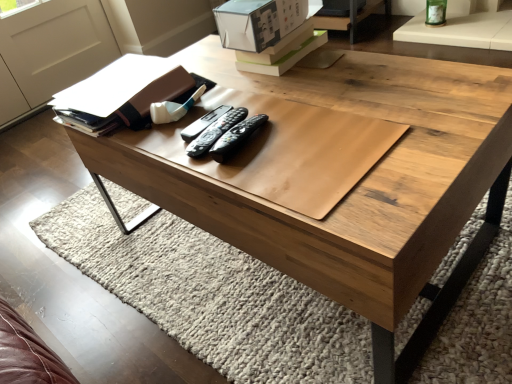
Describe the element at coordinates (258, 22) in the screenshot. The height and width of the screenshot is (384, 512). I see `white cardboard box at upper center` at that location.

Describe the element at coordinates (236, 137) in the screenshot. I see `black plastic remote at center, the 3th remote when ordered from left to right` at that location.

What do you see at coordinates (122, 92) in the screenshot? I see `matte brown book at upper left` at bounding box center [122, 92].

Where is `black plastic remote at center, marked as the 2th remote in a right-to-left arrangement`? The width and height of the screenshot is (512, 384). black plastic remote at center, marked as the 2th remote in a right-to-left arrangement is located at coordinates (211, 129).

Find the location of `white cardboard box at upper center`. white cardboard box at upper center is located at coordinates (258, 22).

Where is `cardboard box above the black plastic remote at center, acting as the 1th remote starting from the right (from the image's perspective)`? This screenshot has height=384, width=512. cardboard box above the black plastic remote at center, acting as the 1th remote starting from the right (from the image's perspective) is located at coordinates (258, 22).

Who is bigger, black plastic remote at center, acting as the 1th remote starting from the right, or white cardboard box at upper center?

Bigger between the two is white cardboard box at upper center.

Is black plastic remote at center, the 3th remote when ordered from left to right, positioned with its back to white cardboard box at upper center?

No, black plastic remote at center, the 3th remote when ordered from left to right,'s orientation is not away from white cardboard box at upper center.

Which is more to the right, black plastic remote at center, the 3th remote when ordered from left to right, or matte brown book at upper left?

black plastic remote at center, the 3th remote when ordered from left to right, is more to the right.

Could you tell me if black plastic remote at center, the 3th remote when ordered from left to right, is facing matte brown book at upper left?

No.

Is black plastic remote at center, acting as the 1th remote starting from the right, positioned before matte brown book at upper left?

That is True.

From a real-world perspective, which object stands above the other?

white cardboard box at upper center is physically above.

From the image's perspective, is white cardboard box at upper center above or below black plastic remote at center, which ranks as the 2th remote in left-to-right order?

Clearly, from the image's perspective, white cardboard box at upper center is above black plastic remote at center, which ranks as the 2th remote in left-to-right order.

In the scene shown: Would you consider white cardboard box at upper center to be distant from black plastic remote at center, which ranks as the 2th remote in left-to-right order?

No, white cardboard box at upper center is not far away from black plastic remote at center, which ranks as the 2th remote in left-to-right order.

Which is in front, point (288, 10) or point (206, 144)?

Positioned in front is point (206, 144).

Considering the relative sizes of black plastic remote at center, which ranks as the third remote in right-to-left order, and black plastic remote at center, acting as the 1th remote starting from the right, in the image provided, is black plastic remote at center, which ranks as the third remote in right-to-left order, wider than black plastic remote at center, acting as the 1th remote starting from the right,?

In fact, black plastic remote at center, which ranks as the third remote in right-to-left order, might be narrower than black plastic remote at center, acting as the 1th remote starting from the right.

Looking at this image, from the image's perspective, between black plastic remote at center, marked as the 1th remote in a left-to-right arrangement, and black plastic remote at center, acting as the 1th remote starting from the right, who is located below?

From the image's view, black plastic remote at center, acting as the 1th remote starting from the right, is below.

Which of these two, black plastic remote at center, which ranks as the third remote in right-to-left order, or black plastic remote at center, acting as the 1th remote starting from the right, stands taller?

With more height is black plastic remote at center, acting as the 1th remote starting from the right.

From a real-world perspective, who is located lower, white cardboard box at upper center or black plastic remote at center, marked as the 1th remote in a left-to-right arrangement?

In real-world perspective, black plastic remote at center, marked as the 1th remote in a left-to-right arrangement, is lower.

Is the depth of white cardboard box at upper center greater than that of black plastic remote at center, which ranks as the third remote in right-to-left order?

Yes, it is behind black plastic remote at center, which ranks as the third remote in right-to-left order.

Is white cardboard box at upper center shorter than black plastic remote at center, marked as the 1th remote in a left-to-right arrangement?

In fact, white cardboard box at upper center may be taller than black plastic remote at center, marked as the 1th remote in a left-to-right arrangement.

Can you confirm if white cardboard box at upper center is positioned to the left of black plastic remote at center, marked as the 1th remote in a left-to-right arrangement?

In fact, white cardboard box at upper center is to the right of black plastic remote at center, marked as the 1th remote in a left-to-right arrangement.

Is black plastic remote at center, marked as the 1th remote in a left-to-right arrangement, further to camera compared to black plastic remote at center, which ranks as the 2th remote in left-to-right order?

Yes, black plastic remote at center, marked as the 1th remote in a left-to-right arrangement, is further from the camera.

Which of these two, black plastic remote at center, marked as the 1th remote in a left-to-right arrangement, or black plastic remote at center, marked as the 2th remote in a right-to-left arrangement, is wider?

black plastic remote at center, marked as the 2th remote in a right-to-left arrangement.

Is black plastic remote at center, marked as the 1th remote in a left-to-right arrangement, inside or outside of black plastic remote at center, which ranks as the 2th remote in left-to-right order?

black plastic remote at center, marked as the 1th remote in a left-to-right arrangement, is outside black plastic remote at center, which ranks as the 2th remote in left-to-right order.

Which point is more forward, (211, 120) or (206, 152)?

The point (206, 152) is more forward.

Who is bigger, black plastic remote at center, marked as the 2th remote in a right-to-left arrangement, or black plastic remote at center, the 3th remote when ordered from left to right?

With larger size is black plastic remote at center, the 3th remote when ordered from left to right.

Which is correct: black plastic remote at center, marked as the 2th remote in a right-to-left arrangement, is inside black plastic remote at center, the 3th remote when ordered from left to right, or outside of it?

black plastic remote at center, marked as the 2th remote in a right-to-left arrangement, exists outside the volume of black plastic remote at center, the 3th remote when ordered from left to right.

Are black plastic remote at center, marked as the 2th remote in a right-to-left arrangement, and black plastic remote at center, the 3th remote when ordered from left to right, beside each other?

Yes, black plastic remote at center, marked as the 2th remote in a right-to-left arrangement, is beside black plastic remote at center, the 3th remote when ordered from left to right.

Locate an element on the screen. the 1st remote below the white cardboard box at upper center (from a real-world perspective) is located at coordinates click(x=236, y=137).

The image size is (512, 384). I want to click on book that is behind the black plastic remote at center, the 3th remote when ordered from left to right, so click(x=122, y=92).

Estimate the real-world distances between objects in this image. Which object is further from white cardboard box at upper center, black plastic remote at center, the 3th remote when ordered from left to right, or black plastic remote at center, marked as the 1th remote in a left-to-right arrangement?

Among the two, black plastic remote at center, the 3th remote when ordered from left to right, is located further to white cardboard box at upper center.

Looking at the image, which one is located closer to black plastic remote at center, the 3th remote when ordered from left to right, matte brown book at upper left or black plastic remote at center, which ranks as the 2th remote in left-to-right order?

black plastic remote at center, which ranks as the 2th remote in left-to-right order, is closer to black plastic remote at center, the 3th remote when ordered from left to right.

Considering their positions, is black plastic remote at center, which ranks as the third remote in right-to-left order, positioned closer to white cardboard box at upper center than matte brown book at upper left?

Based on the image, matte brown book at upper left appears to be nearer to white cardboard box at upper center.

Based on the photo, considering their positions, is black plastic remote at center, which ranks as the 2th remote in left-to-right order, positioned further to black plastic remote at center, the 3th remote when ordered from left to right, than white cardboard box at upper center?

Among the two, white cardboard box at upper center is located further to black plastic remote at center, the 3th remote when ordered from left to right.

Estimate the real-world distances between objects in this image. Which object is closer to black plastic remote at center, which ranks as the 2th remote in left-to-right order, white cardboard box at upper center or black plastic remote at center, marked as the 1th remote in a left-to-right arrangement?

black plastic remote at center, marked as the 1th remote in a left-to-right arrangement, is closer to black plastic remote at center, which ranks as the 2th remote in left-to-right order.

Considering their positions, is black plastic remote at center, acting as the 1th remote starting from the right, positioned closer to black plastic remote at center, marked as the 1th remote in a left-to-right arrangement, than white cardboard box at upper center?

The object closer to black plastic remote at center, marked as the 1th remote in a left-to-right arrangement, is black plastic remote at center, acting as the 1th remote starting from the right.

Based on their spatial positions, is black plastic remote at center, marked as the 1th remote in a left-to-right arrangement, or matte brown book at upper left further from black plastic remote at center, acting as the 1th remote starting from the right?

matte brown book at upper left lies further to black plastic remote at center, acting as the 1th remote starting from the right, than the other object.

From the picture: Looking at the image, which one is located further to black plastic remote at center, marked as the 2th remote in a right-to-left arrangement, matte brown book at upper left or black plastic remote at center, the 3th remote when ordered from left to right?

matte brown book at upper left lies further to black plastic remote at center, marked as the 2th remote in a right-to-left arrangement, than the other object.

At what (x,y) coordinates should I click in order to perform the action: click on remote between white cardboard box at upper center and black plastic remote at center, acting as the 1th remote starting from the right, in the up-down direction. Please return your answer as a coordinate pair (x, y). Looking at the image, I should click on (203, 123).

Identify the location of remote situated between matte brown book at upper left and black plastic remote at center, which ranks as the 2th remote in left-to-right order, from left to right. (203, 123).

Where is `remote between black plastic remote at center, acting as the 1th remote starting from the right, and black plastic remote at center, which ranks as the third remote in right-to-left order, along the z-axis`? The image size is (512, 384). remote between black plastic remote at center, acting as the 1th remote starting from the right, and black plastic remote at center, which ranks as the third remote in right-to-left order, along the z-axis is located at coordinates (211, 129).